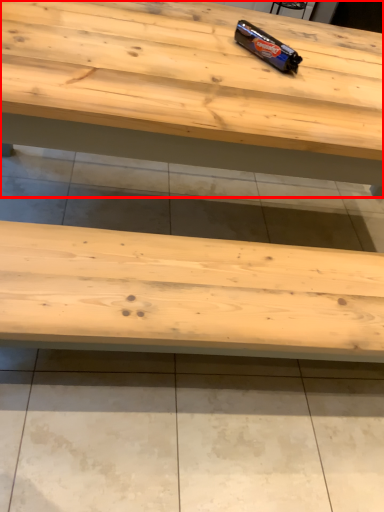
Question: From the image's perspective, where is table (annotated by the red box) located in relation to chocolate bar in the image?

Choices:
 (A) below
 (B) above

Answer: (A)